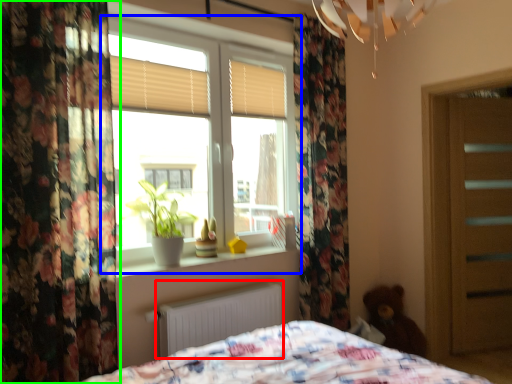
Question: Which is farther away from radiator (highlighted by a red box)? window (highlighted by a blue box) or curtain (highlighted by a green box)?

Choices:
 (A) window
 (B) curtain

Answer: (A)